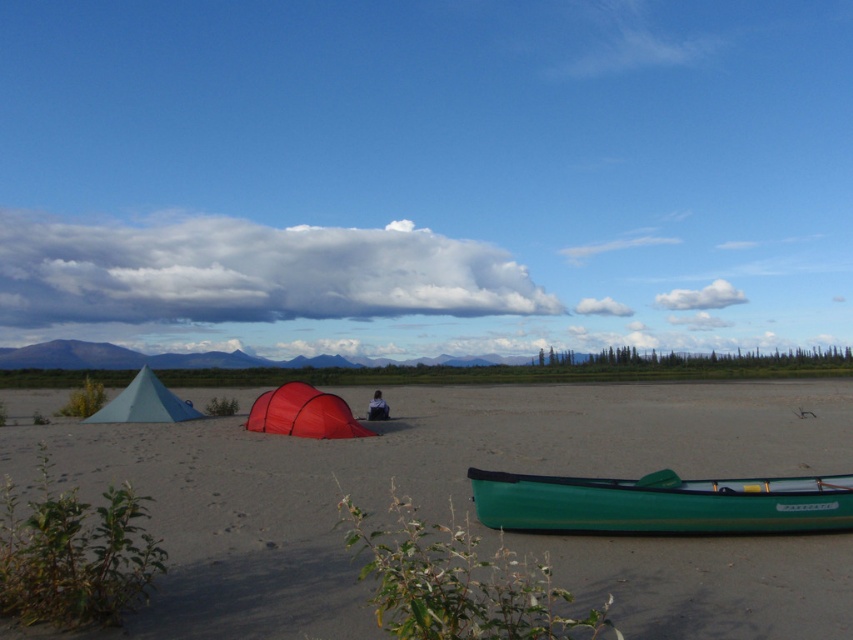
Describe the element at coordinates (401, 481) in the screenshot. I see `matte blue tent at center` at that location.

Who is more forward, [349,480] or [724,493]?

Point [724,493] is more forward.

Is point (292, 512) closer to camera compared to point (776, 477)?

Yes.

Where is `matte blue tent at center`? This screenshot has width=853, height=640. matte blue tent at center is located at coordinates [401, 481].

Which is in front, point (775, 522) or point (111, 420)?

Positioned in front is point (775, 522).

Between green glossy canoe at lower center and matte green tent at left, which one appears on the right side from the viewer's perspective?

green glossy canoe at lower center is more to the right.

Does point (563, 518) come closer to viewer compared to point (158, 404)?

Yes, it is.

Identify the location of green glossy canoe at lower center. This screenshot has height=640, width=853. (660, 502).

Consider the image. Is green glossy canoe at lower center positioned behind dark blue fabric at center?

No.

Who is higher up, green glossy canoe at lower center or dark blue fabric at center?

green glossy canoe at lower center

Does point (846, 486) lie behind point (378, 404)?

No, (846, 486) is in front of (378, 404).

Where is `green glossy canoe at lower center`? The height and width of the screenshot is (640, 853). green glossy canoe at lower center is located at coordinates coord(660,502).